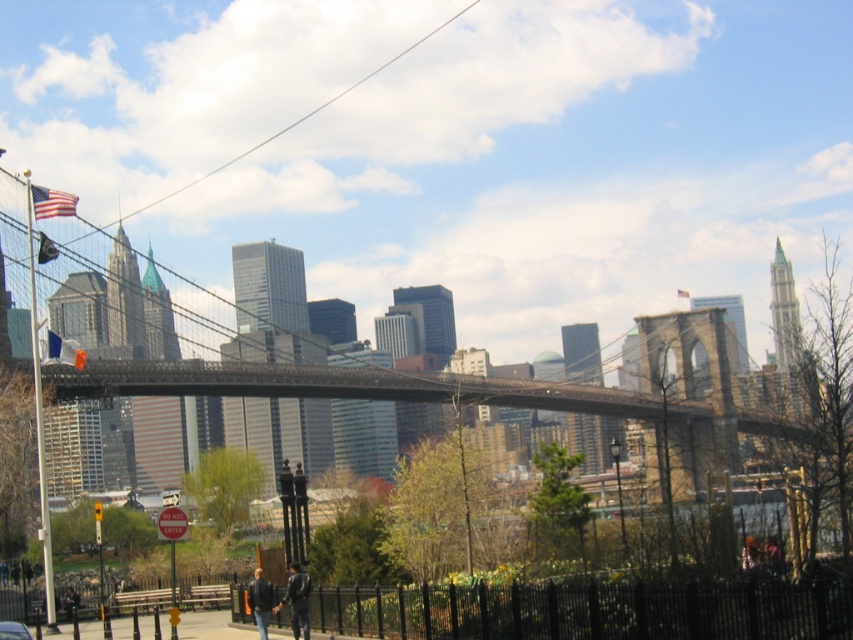
Does metallic gray suspension bridge at center have a greater width compared to metallic silver car at lower left?

Correct, the width of metallic gray suspension bridge at center exceeds that of metallic silver car at lower left.

From the picture: Is metallic gray suspension bridge at center shorter than metallic silver car at lower left?

Incorrect, metallic gray suspension bridge at center's height does not fall short of metallic silver car at lower left's.

Which is behind, point (529, 404) or point (0, 637)?

The point (529, 404) is behind.

This screenshot has width=853, height=640. In order to click on metallic gray suspension bridge at center in this screenshot , I will do 13,230.